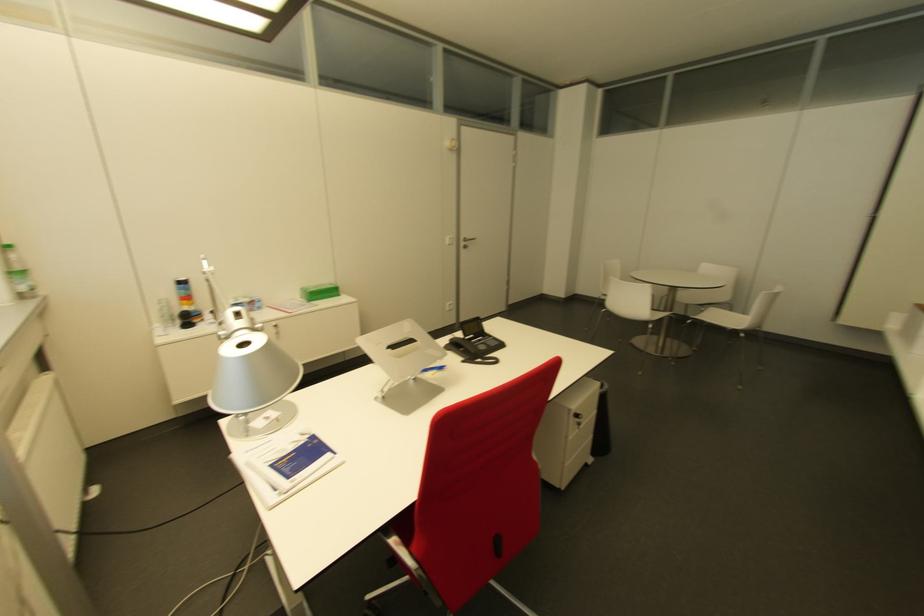
Where is `phone keypad buttons`? phone keypad buttons is located at coordinates (490, 344).